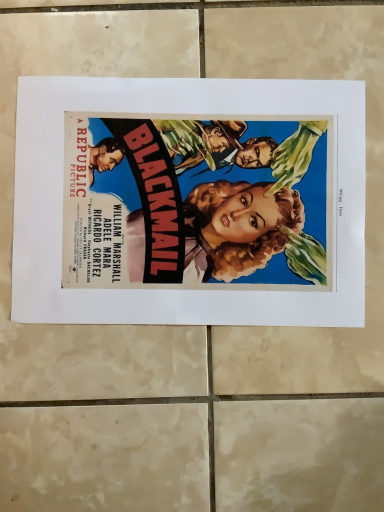
Describe the element at coordinates (189, 202) in the screenshot. I see `matte paper poster at center` at that location.

Locate an element on the screen. This screenshot has height=512, width=384. matte paper poster at center is located at coordinates (189, 202).

The height and width of the screenshot is (512, 384). In order to click on matte paper poster at center in this screenshot , I will do `click(189, 202)`.